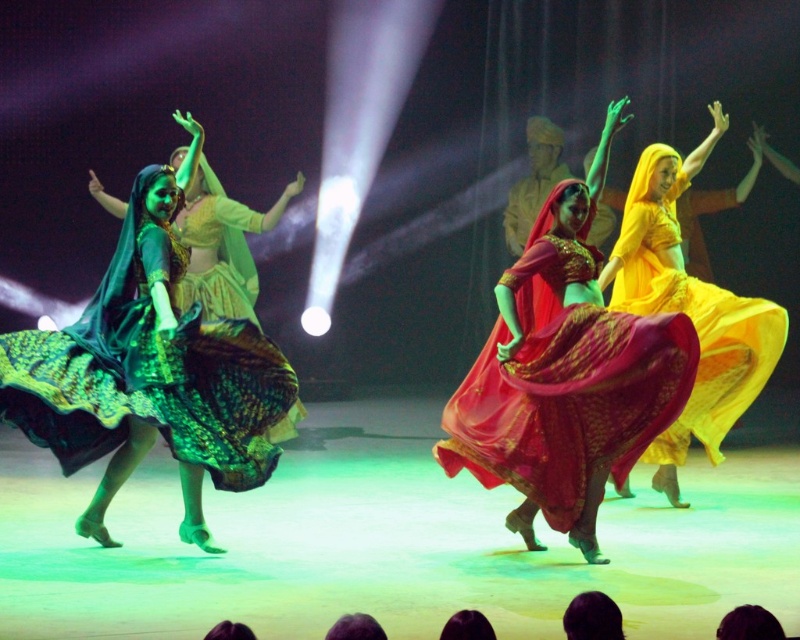
Can you confirm if matte red dress at center is shorter than green satin dress at left?

No, matte red dress at center is not shorter than green satin dress at left.

Does matte red dress at center have a smaller size compared to green satin dress at left?

Actually, matte red dress at center might be larger than green satin dress at left.

Who is more forward, (580, 502) or (236, 346)?

Point (580, 502) is in front.

Identify the location of matte red dress at center. The height and width of the screenshot is (640, 800). (566, 374).

Is the position of matte red dress at center more distant than that of matte yellow dress at right?

No, it is in front of matte yellow dress at right.

The width and height of the screenshot is (800, 640). Identify the location of matte red dress at center. (566, 374).

Is green satin dress at left positioned behind matte yellow dress at right?

That is False.

This screenshot has width=800, height=640. What do you see at coordinates (148, 371) in the screenshot? I see `green satin dress at left` at bounding box center [148, 371].

Between point (248, 456) and point (658, 484), which one is positioned behind?

Point (658, 484)

Locate an element on the screen. Image resolution: width=800 pixels, height=640 pixels. green satin dress at left is located at coordinates (148, 371).